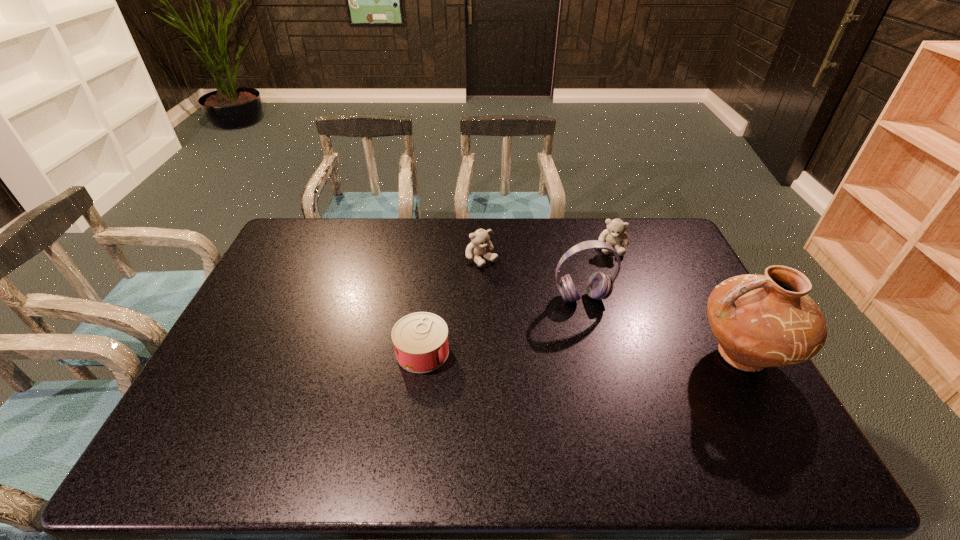
You are a GUI agent. You are given a task and a screenshot of the screen. Output one action in this format:
    pyautogui.click(x=<x>, y=<y>)
    Task: Click on the vacant position located 0.240m on the headband and ear cups of the third object from right to left
    This screenshot has height=540, width=960.
    Given the screenshot: What is the action you would take?
    pyautogui.click(x=616, y=371)

Image resolution: width=960 pixels, height=540 pixels. What are the coordinates of `object that is positioned at the near edge` in the screenshot? It's located at (760, 321).

Find the location of a particular element. Image resolution: width=960 pixels, height=540 pixels. object located at the right edge is located at coordinates (760, 321).

This screenshot has height=540, width=960. Find the location of `object that is at the near right corner`. object that is at the near right corner is located at coordinates (760, 321).

In the image, there is a desktop. At what (x,y) coordinates should I click in order to perform the action: click on vacant space at the far edge. Please return your answer as a coordinate pair (x, y). This screenshot has height=540, width=960. Looking at the image, I should click on (493, 232).

At what (x,y) coordinates should I click in order to perform the action: click on blank space at the near edge of the desktop. Please return your answer as a coordinate pair (x, y). This screenshot has width=960, height=540. Looking at the image, I should click on (701, 403).

Where is `free space at the left edge of the desktop`? This screenshot has height=540, width=960. free space at the left edge of the desktop is located at coordinates (240, 319).

This screenshot has width=960, height=540. Identify the location of vacant space at the right edge of the desktop. (706, 291).

Find the location of `unoccupied position between the third nearest object and the pottery`. unoccupied position between the third nearest object and the pottery is located at coordinates (662, 327).

Find the location of a particular element. The image size is (960, 540). vacant area that lies between the leftmost object and the left teddy bear is located at coordinates (452, 306).